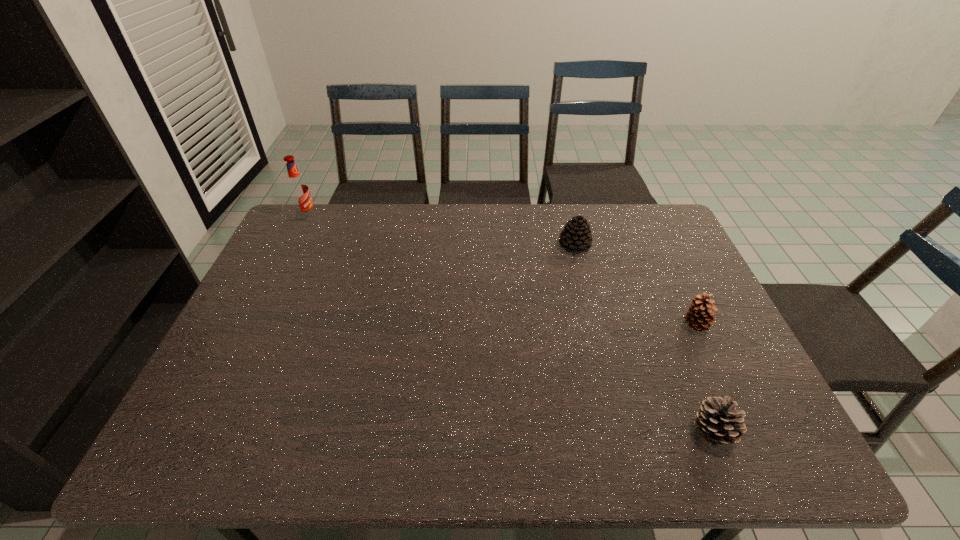
The height and width of the screenshot is (540, 960). In the image, there is a desktop. What are the coordinates of `free region at the near right corner` in the screenshot? It's located at (764, 434).

This screenshot has height=540, width=960. What are the coordinates of `vacant area that lies between the nearest object and the second object from left to right` in the screenshot? It's located at (643, 339).

This screenshot has width=960, height=540. Identify the location of free space between the nearest object and the second nearest object. (704, 378).

At what (x,y) coordinates should I click in order to perform the action: click on unoccupied area between the nearest object and the farthest object. Please return your answer as a coordinate pair (x, y). This screenshot has width=960, height=540. Looking at the image, I should click on (510, 325).

The height and width of the screenshot is (540, 960). What are the coordinates of `unoccupied position between the second object from left to right and the root beer` in the screenshot? It's located at (441, 232).

Find the location of a particular element. Image resolution: width=960 pixels, height=540 pixels. vacant space that is in between the second object from left to right and the second nearest object is located at coordinates (635, 286).

Locate an element on the screen. vacant region between the leftmost pinecone and the root beer is located at coordinates (441, 232).

This screenshot has height=540, width=960. What are the coordinates of `vacant space that's between the nearest pinecone and the second nearest object` in the screenshot? It's located at (704, 378).

Locate an element on the screen. The image size is (960, 540). vacant area between the leftmost pinecone and the third farthest object is located at coordinates (635, 286).

Locate an element on the screen. The height and width of the screenshot is (540, 960). vacant space that is in between the third farthest object and the farthest object is located at coordinates (501, 272).